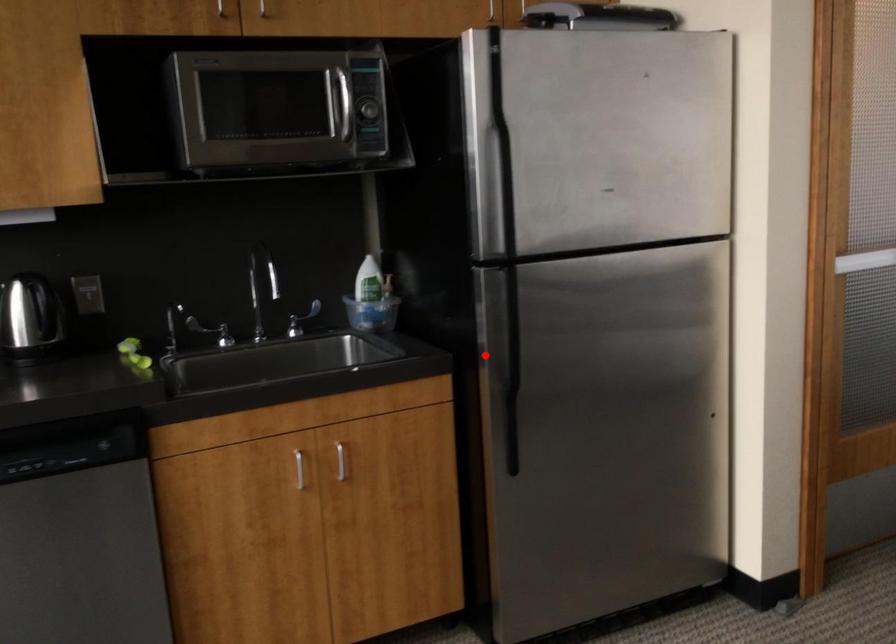
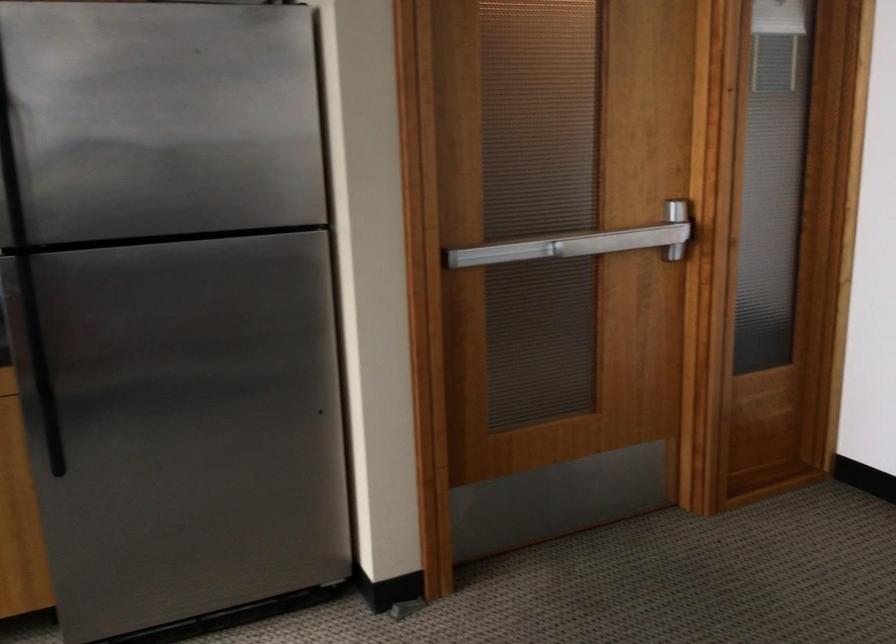
In the second image, find the point that corresponds to the highlighted location in the first image.

(37, 352)